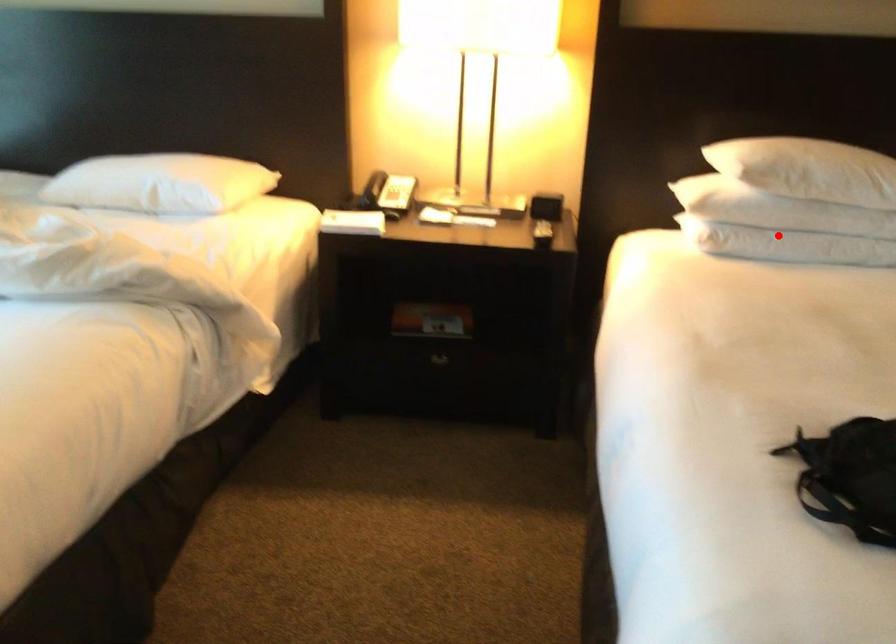
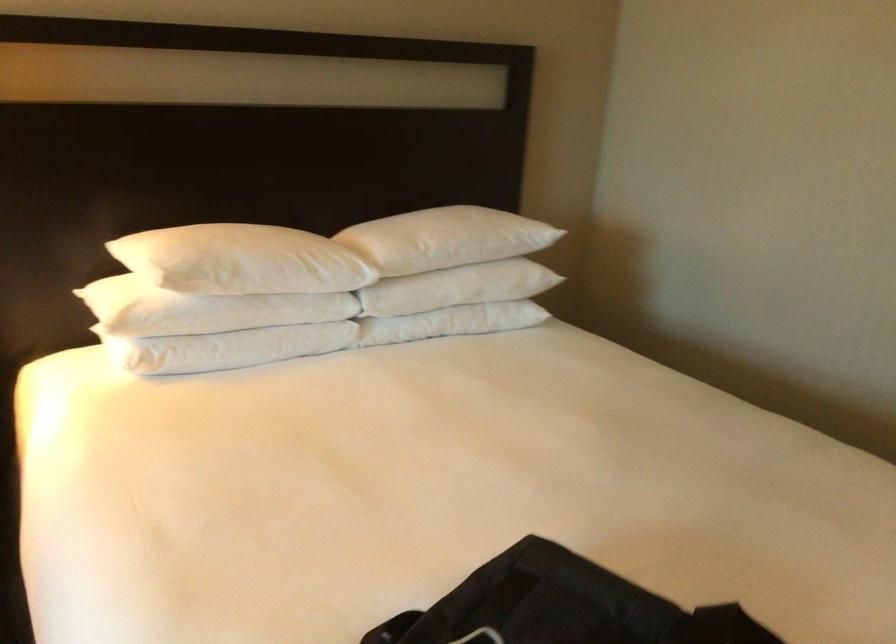
Locate, in the second image, the point that corresponds to the highlighted location in the first image.

(226, 348)